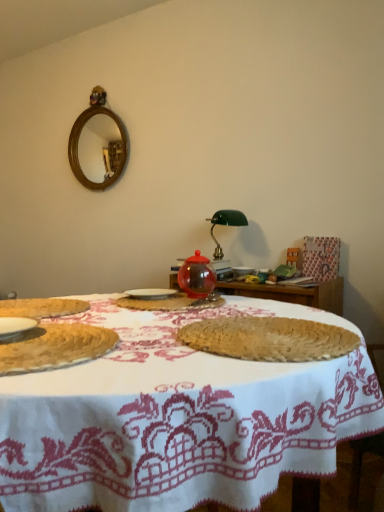
The image size is (384, 512). What do you see at coordinates (225, 225) in the screenshot?
I see `green glass table lamp at center` at bounding box center [225, 225].

The image size is (384, 512). I want to click on white ceramic plate at center, so click(x=150, y=293).

Describe the element at coordinates (196, 276) in the screenshot. I see `transparent glass teapot at center` at that location.

This screenshot has height=512, width=384. Find the location of `transparent glass teapot at center`. transparent glass teapot at center is located at coordinates (196, 276).

You are a GUI agent. You are given a task and a screenshot of the screen. Output one action in this format:
    pyautogui.click(x=<x>, y=<y>)
    Task: Click on the green glass table lamp at center
    Image resolution: width=384 pixels, height=512 pixels.
    Given the screenshot: What is the action you would take?
    pyautogui.click(x=225, y=225)

Are white woven placemat at center and white ceramic plate at center far apart?

No, white woven placemat at center is not far away from white ceramic plate at center.

What's the angular difference between white woven placemat at center and white ceramic plate at center's facing directions?

The facing directions of white woven placemat at center and white ceramic plate at center are 12.2 degrees apart.

From the image's perspective, which is above, white woven placemat at center or white ceramic plate at center?

From the image's view, white ceramic plate at center is above.

Considering the relative positions of white woven placemat at center and braided straw placemat at center, the second food positioned from the back, in the image provided, is white woven placemat at center to the right of braided straw placemat at center, the second food positioned from the back, from the viewer's perspective?

Incorrect, white woven placemat at center is not on the right side of braided straw placemat at center, the second food positioned from the back.

From the picture: Could you tell me if white woven placemat at center is facing braided straw placemat at center, the second food positioned from the back?

No, white woven placemat at center is not aimed at braided straw placemat at center, the second food positioned from the back.

Who is smaller, white woven placemat at center or braided straw placemat at center, arranged as the second food when viewed from the front?

Smaller between the two is braided straw placemat at center, arranged as the second food when viewed from the front.

Is white woven placemat at center shorter than braided straw placemat at center, the second food positioned from the back?

No, white woven placemat at center is not shorter than braided straw placemat at center, the second food positioned from the back.

Is green glass table lamp at center oriented towards white woven placemat at center?

Yes, green glass table lamp at center is oriented towards white woven placemat at center.

Which is in front, green glass table lamp at center or white woven placemat at center?

white woven placemat at center is in front.

From the image's perspective, between green glass table lamp at center and white woven placemat at center, which one is located above?

green glass table lamp at center.

From the image's perspective, between transparent glass teapot at center and white ceramic plate at center, which one is located above?

transparent glass teapot at center.

Can you confirm if transparent glass teapot at center is bigger than white ceramic plate at center?

Yes.

Does point (199, 290) come in front of point (153, 297)?

No.

Is transparent glass teapot at center looking in the opposite direction of white ceramic plate at center?

transparent glass teapot at center is not turned away from white ceramic plate at center.

Image resolution: width=384 pixels, height=512 pixels. I want to click on table that is in front of the white ceramic plate at center, so (178, 418).

From a real-world perspective, is white ceramic plate at center positioned above or below white woven placemat at center?

white ceramic plate at center is situated higher than white woven placemat at center in the real world.

Can you confirm if white ceramic plate at center is thinner than white woven placemat at center?

Yes.

From the picture: What's the angular difference between white ceramic plate at center and white woven placemat at center's facing directions?

white ceramic plate at center and white woven placemat at center are facing 12.2 degrees away from each other.

Is white ceramic plate at center surrounding braided straw placemat at center, the second food positioned from the back?

Actually, braided straw placemat at center, the second food positioned from the back, is outside white ceramic plate at center.

Considering the positions of point (157, 290) and point (203, 342), is point (157, 290) closer or farther from the camera than point (203, 342)?

Clearly, point (157, 290) is more distant from the camera than point (203, 342).

Could you tell me if white ceramic plate at center is turned towards braided straw placemat at center, arranged as the second food when viewed from the front?

No, white ceramic plate at center is not oriented towards braided straw placemat at center, arranged as the second food when viewed from the front.

Who is taller, white ceramic plate at center or transparent glass teapot at center?

transparent glass teapot at center is taller.

Consider the image. From a real-world perspective, is white ceramic plate at center under transparent glass teapot at center?

Yes, from a real-world perspective, white ceramic plate at center is under transparent glass teapot at center.

Is white ceramic plate at center inside the boundaries of transparent glass teapot at center, or outside?

white ceramic plate at center is located beyond the bounds of transparent glass teapot at center.

From the image's perspective, is white ceramic plate at center below transparent glass teapot at center?

Correct, white ceramic plate at center appears lower than transparent glass teapot at center in the image.

You are a GUI agent. You are given a task and a screenshot of the screen. Output one action in this format:
    pyautogui.click(x=<x>, y=<y>)
    Task: Click on the table on the left of the white ceramic plate at center
    This screenshot has height=512, width=384.
    Given the screenshot: What is the action you would take?
    pyautogui.click(x=178, y=418)

Where is `the 2nd food behind the white woven placemat at center`? the 2nd food behind the white woven placemat at center is located at coordinates tap(269, 339).

Considering their positions, is braided straw placemat at center, arranged as the second food when viewed from the front, positioned closer to white woven placemat at center than white ceramic plate at center?

braided straw placemat at center, arranged as the second food when viewed from the front, lies closer to white woven placemat at center than the other object.

Estimate the real-world distances between objects in this image. Which object is further from white woven placemat at center, white ceramic plate at center or green glass table lamp at center?

green glass table lamp at center.

Considering their positions, is braided straw placemat at center, the second food positioned from the back, positioned closer to bread at left, the third food from the back, than green glass table lamp at center?

braided straw placemat at center, the second food positioned from the back.

Looking at the image, which one is located closer to green glass table lamp at center, white woven placemat at center or bread at left, the third food from the back?

The object closer to green glass table lamp at center is white woven placemat at center.

Based on their spatial positions, is white ceramic plate at center or white woven placemat at center closer to braided straw placemat at center, the second food positioned from the back?

white woven placemat at center is closer to braided straw placemat at center, the second food positioned from the back.

When comparing their distances from transparent glass teapot at center, does transparent glass jar at center, which appears as the first food when viewed from the back, or white ceramic plate at center seem closer?

transparent glass jar at center, which appears as the first food when viewed from the back, lies closer to transparent glass teapot at center than the other object.

Considering their positions, is transparent glass jar at center, which appears as the first food when viewed from the back, positioned closer to white ceramic plate at center than bread at left, which is the 1th food in front-to-back order?

Among the two, transparent glass jar at center, which appears as the first food when viewed from the back, is located nearer to white ceramic plate at center.

Which object lies further to the anchor point white ceramic plate at center, transparent glass jar at center, which is the 3th food in front-to-back order, or white woven placemat at center?

white woven placemat at center.

At what (x,y) coordinates should I click in order to perform the action: click on tableware located between transparent glass jar at center, which appears as the first food when viewed from the back, and green glass table lamp at center in the depth direction. Please return your answer as a coordinate pair (x, y). This screenshot has width=384, height=512. Looking at the image, I should click on (150, 293).

You are a GUI agent. You are given a task and a screenshot of the screen. Output one action in this format:
    pyautogui.click(x=<x>, y=<y>)
    Task: Click on the tea pot between white ceramic plate at center and green glass table lamp at center in the front-back direction
    The width and height of the screenshot is (384, 512).
    Given the screenshot: What is the action you would take?
    pyautogui.click(x=196, y=276)

Locate an element on the screen. This screenshot has width=384, height=512. tableware between white woven placemat at center and transparent glass teapot at center from front to back is located at coordinates (150, 293).

Locate an element on the screen. The image size is (384, 512). tea pot between transparent glass jar at center, which appears as the first food when viewed from the back, and green glass table lamp at center, along the z-axis is located at coordinates (196, 276).